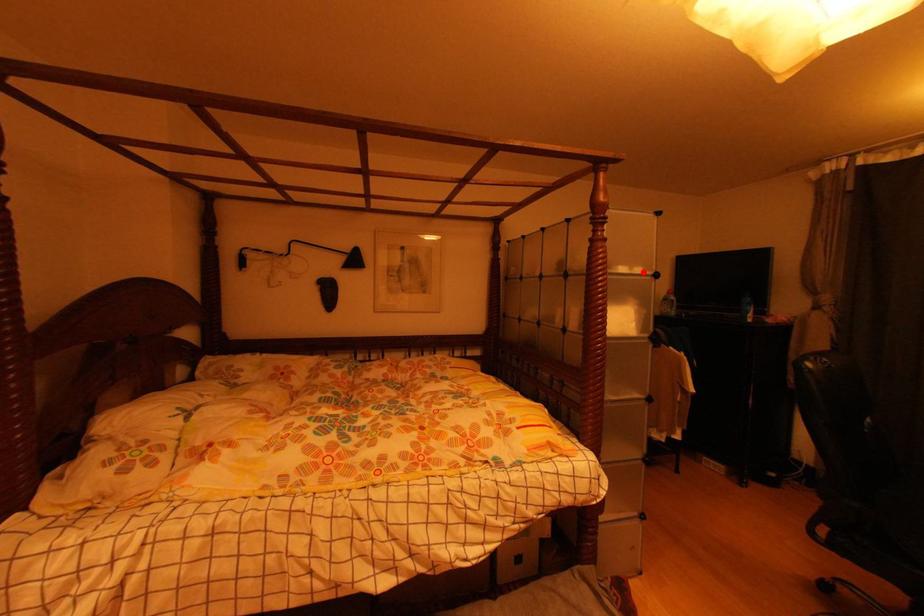
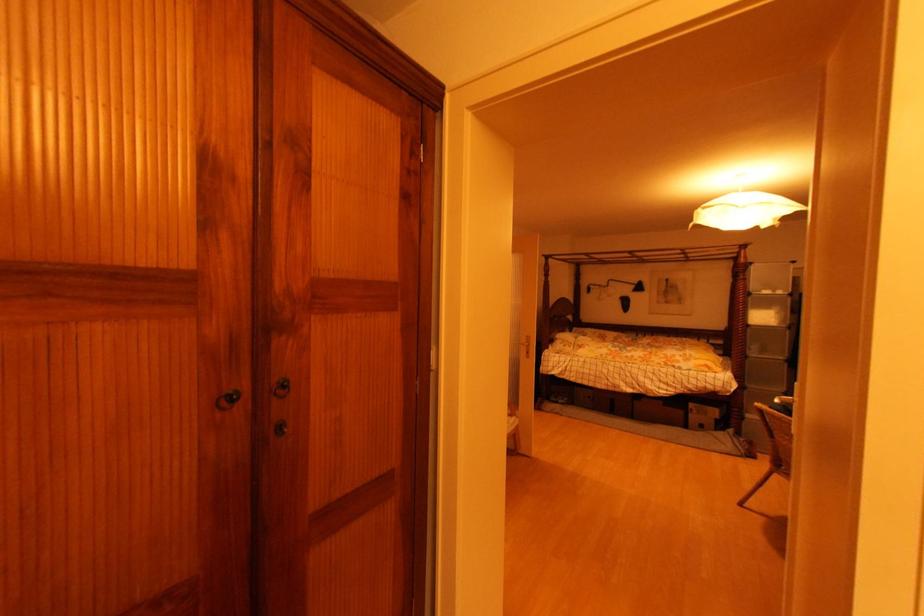
Where in the second image is the point corresponding to the highlighted location from the first image?

(784, 294)